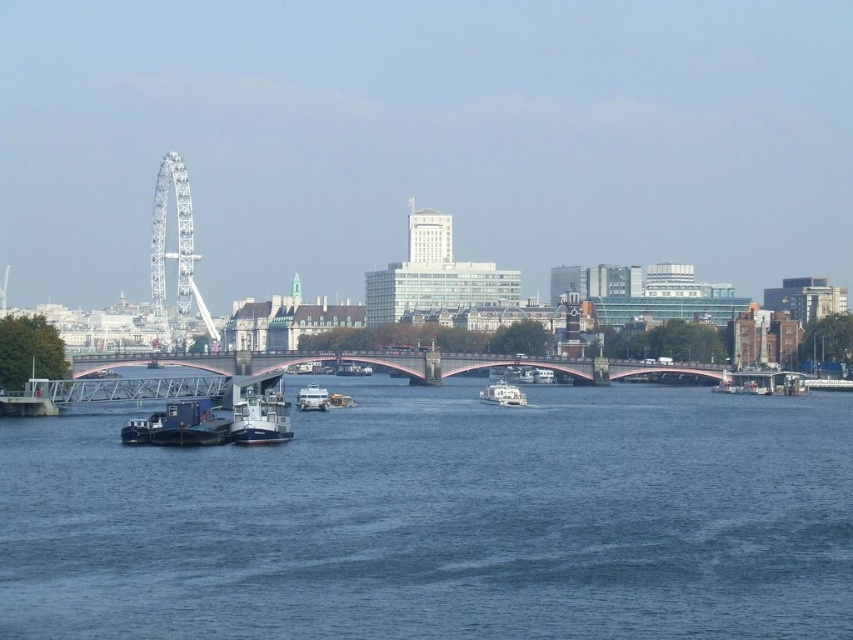
You are standing on the red bridge and looking at two points in the scene. The first point is at coordinate point(187,429) and the second is at point(485,397). Which point is closer to your current position on the bridge?

Point(187,429) is closer to the camera than point(485,397), so the first point is closer to your current position on the bridge.

You are a tourist standing on the riverbank and want to take a photo of the metallic bridge at center. If your camera can focus on objects up to 400 feet away, will you need to move closer to capture a clear image?

The metallic bridge at center is 413.01 feet away from the camera. Since this distance exceeds the camera maximum focus range of 400 feet, you need to move closer to ensure the metallic bridge at center is in focus.